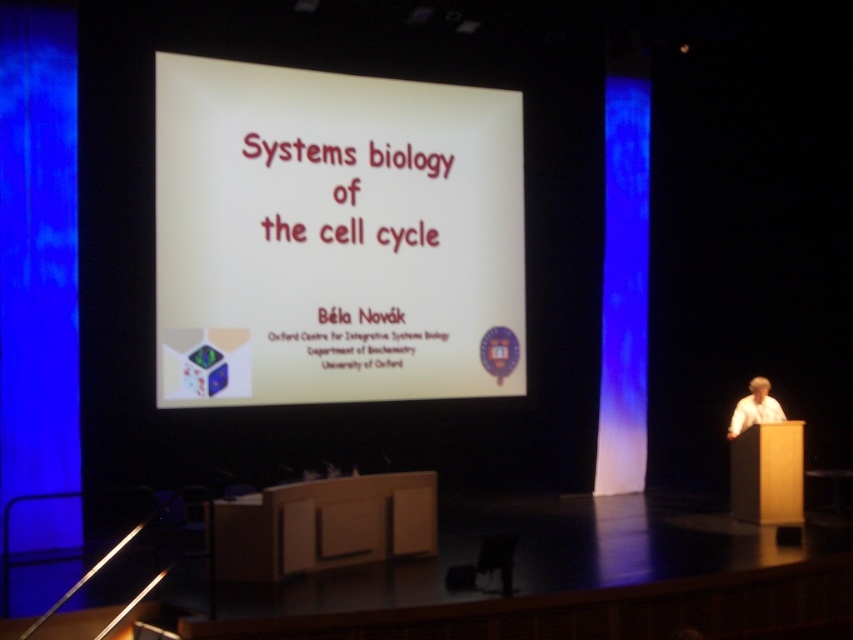
Does white paper at center lie behind white paper at right?

Yes, it is.

Who is positioned more to the left, white paper at center or white paper at right?

From the viewer's perspective, white paper at center appears more on the left side.

Is point (318, 314) closer to camera compared to point (776, 404)?

No, (318, 314) is behind (776, 404).

Locate an element on the screen. The width and height of the screenshot is (853, 640). white paper at center is located at coordinates (334, 236).